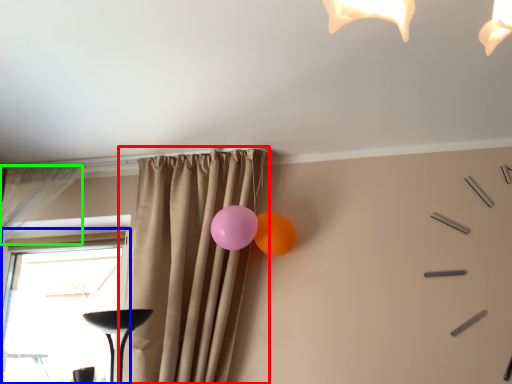
Question: Estimate the real-world distances between objects in this image. Which object is farther from curtain (highlighted by a red box), window (highlighted by a blue box) or curtain (highlighted by a green box)?

Choices:
 (A) window
 (B) curtain

Answer: (A)